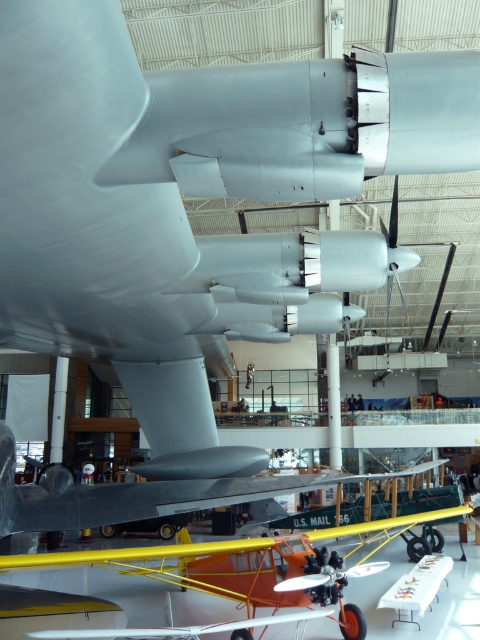
Is orange matte airplane at lower center thinner than metallic silver airplane at center?

Correct, orange matte airplane at lower center's width is less than metallic silver airplane at center's.

Can you confirm if orange matte airplane at lower center is shorter than metallic silver airplane at center?

No.

What do you see at coordinates (227, 556) in the screenshot?
I see `orange matte airplane at lower center` at bounding box center [227, 556].

This screenshot has height=640, width=480. What are the coordinates of `orange matte airplane at lower center` in the screenshot? It's located at (227, 556).